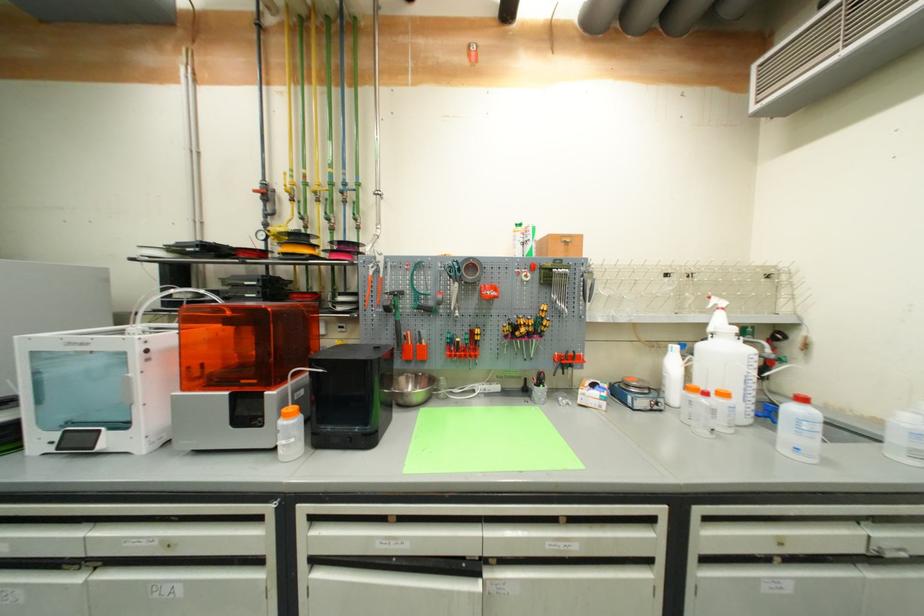
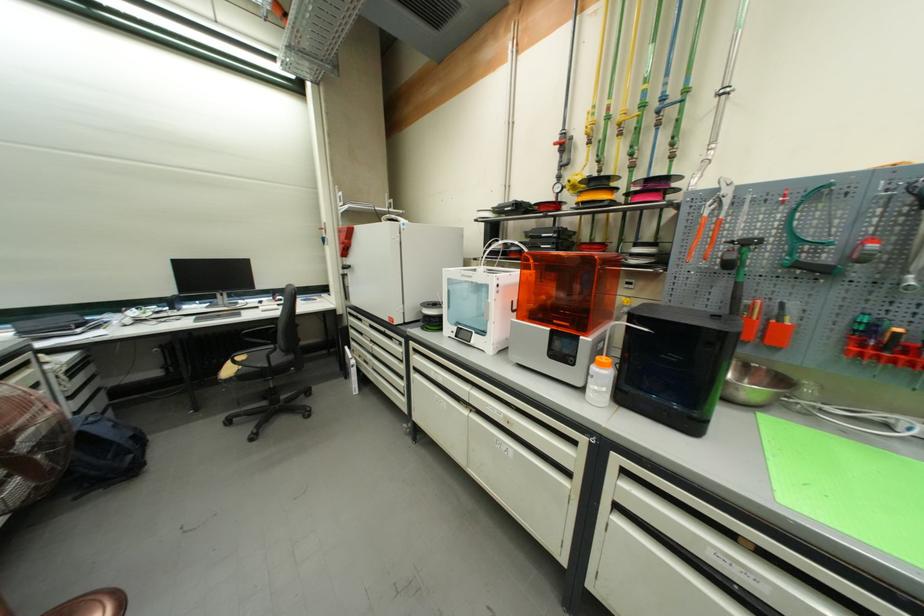
Find the pixel in the second image that matches (419,377) in the first image.

(745, 363)